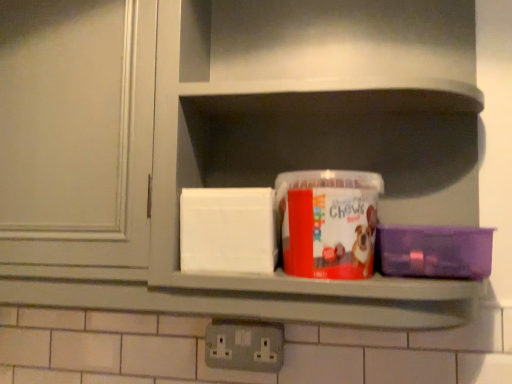
Question: From a real-world perspective, is purple plastic container at right, which appears as the 1th box when viewed from the right, above or below gray plastic electrical outlet at lower center?

Choices:
 (A) above
 (B) below

Answer: (A)

Question: Is point (416, 228) positioned closer to the camera than point (279, 332)?

Choices:
 (A) farther
 (B) closer

Answer: (B)

Question: Which object is the closest to the gray plastic electrical outlet at lower center?

Choices:
 (A) translucent plastic container at center, the 1th box positioned from the left
 (B) matte plastic container at center
 (C) purple plastic container at right, positioned as the second box in left-to-right order

Answer: (A)

Question: Based on their relative distances, which object is nearer to the gray plastic electrical outlet at lower center?

Choices:
 (A) matte plastic container at center
 (B) translucent plastic container at center, which is the 2th box in right-to-left order
 (C) purple plastic container at right, which appears as the 1th box when viewed from the right

Answer: (B)